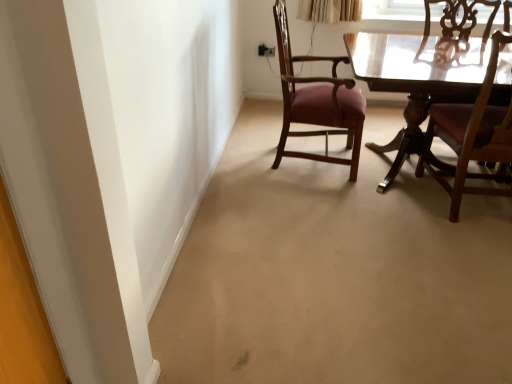
Question: From the image's perspective, is purple upholstered chair at center, the 2th chair from the right, positioned above or below wooden chair at right, the second chair viewed from the left?

Choices:
 (A) below
 (B) above

Answer: (B)

Question: Considering their positions, is purple upholstered chair at center, the 2th chair from the right, located in front of or behind wooden chair at right, placed as the first chair when sorted from right to left?

Choices:
 (A) front
 (B) behind

Answer: (B)

Question: Considering the positions of purple upholstered chair at center, which is counted as the first chair, starting from the left, and wooden chair at right, the second chair viewed from the left, in the image, is purple upholstered chair at center, which is counted as the first chair, starting from the left, wider or thinner than wooden chair at right, the second chair viewed from the left,?

Choices:
 (A) wide
 (B) thin

Answer: (A)

Question: Considering their positions, is wooden chair at right, the second chair viewed from the left, located in front of or behind purple upholstered chair at center, which is counted as the first chair, starting from the left?

Choices:
 (A) front
 (B) behind

Answer: (A)

Question: Considering the positions of wooden chair at right, placed as the first chair when sorted from right to left, and purple upholstered chair at center, the 2th chair from the right, in the image, is wooden chair at right, placed as the first chair when sorted from right to left, wider or thinner than purple upholstered chair at center, the 2th chair from the right,?

Choices:
 (A) thin
 (B) wide

Answer: (A)

Question: From the image's perspective, is wooden chair at right, the second chair viewed from the left, positioned above or below purple upholstered chair at center, the 2th chair from the right?

Choices:
 (A) above
 (B) below

Answer: (B)

Question: From their relative heights in the image, would you say wooden chair at right, the second chair viewed from the left, is taller or shorter than purple upholstered chair at center, which is counted as the first chair, starting from the left?

Choices:
 (A) tall
 (B) short

Answer: (B)